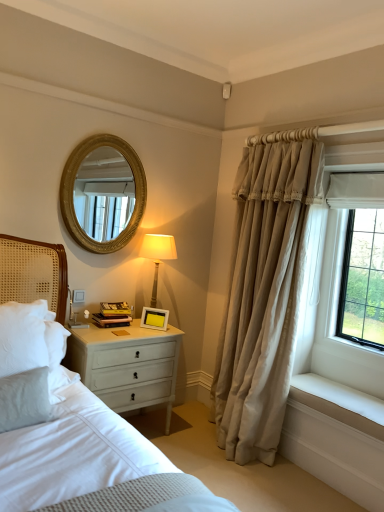
Image resolution: width=384 pixels, height=512 pixels. I want to click on white painted wood nightstand at lower left, so click(x=127, y=365).

The image size is (384, 512). I want to click on matte beige lampshade at upper right, so click(157, 255).

Consider the image. How many degrees apart are the facing directions of white smooth window sill at lower right and matte beige lampshade at upper right?

90.8 degrees.

You are a GUI agent. You are given a task and a screenshot of the screen. Output one action in this format:
    pyautogui.click(x=<x>, y=<y>)
    Task: Click on the window sill on the right of matte beige lampshade at upper right
    This screenshot has width=384, height=512.
    Given the screenshot: What is the action you would take?
    pyautogui.click(x=341, y=395)

Do you think white smooth window sill at lower right is within matte beige lampshade at upper right, or outside of it?

The correct answer is: outside.

Which is behind, white smooth window sill at lower right or matte beige lampshade at upper right?

matte beige lampshade at upper right is more distant.

Locate an element on the screen. The height and width of the screenshot is (512, 384). picture frame to the right of gold textured mirror at upper center is located at coordinates (154, 318).

Which is closer, (154, 323) or (95, 210)?

The point (154, 323) is closer to the camera.

Is white matte picture frame at upper right in contact with gold textured mirror at upper center?

No, white matte picture frame at upper right is not making contact with gold textured mirror at upper center.

Who is smaller, hardcover books at bedside or white painted wood nightstand at lower left?

With smaller size is hardcover books at bedside.

Locate an element on the screen. This screenshot has height=512, width=384. nightstand that is under the hardcover books at bedside (from a real-world perspective) is located at coordinates (127, 365).

From a real-world perspective, is hardcover books at bedside physically below white painted wood nightstand at lower left?

No.

Considering the positions of points (120, 302) and (146, 400), is point (120, 302) farther from camera compared to point (146, 400)?

That is True.

Is white painted wood nightstand at lower left touching hardcover books at bedside?

white painted wood nightstand at lower left and hardcover books at bedside are not in contact.

Considering the sizes of objects white painted wood nightstand at lower left and hardcover books at bedside in the image provided, who is smaller, white painted wood nightstand at lower left or hardcover books at bedside?

hardcover books at bedside.

Does point (140, 334) lie behind point (102, 324)?

No, (140, 334) is closer to viewer.

From the picture: Which of these two, white painted wood nightstand at lower left or hardcover books at bedside, stands taller?

Standing taller between the two is white painted wood nightstand at lower left.

Does white smooth window sill at lower right have a larger size compared to white matte picture frame at upper right?

Yes, white smooth window sill at lower right is bigger than white matte picture frame at upper right.

Is white smooth window sill at lower right outside of white matte picture frame at upper right?

Indeed, white smooth window sill at lower right is completely outside white matte picture frame at upper right.

Is white smooth window sill at lower right not close to white matte picture frame at upper right?

That's right, there is a large distance between white smooth window sill at lower right and white matte picture frame at upper right.

Is white smooth window sill at lower right oriented towards white matte picture frame at upper right?

No, white smooth window sill at lower right is not aimed at white matte picture frame at upper right.

Are beige fabric curtain at right and matte beige lampshade at upper right far apart?

No.

Measure the distance between beige fabric curtain at right and matte beige lampshade at upper right.

beige fabric curtain at right is 34.93 inches away from matte beige lampshade at upper right.

Does point (267, 248) come behind point (141, 245)?

No, (267, 248) is in front of (141, 245).

Find the location of a particular element. picture frame that is behind the beige fabric curtain at right is located at coordinates (154, 318).

From the image's perspective, relative to beige fabric curtain at right, is white matte picture frame at upper right above or below?

Clearly, from the image's perspective, white matte picture frame at upper right is below beige fabric curtain at right.

Consider the image. Considering the sizes of white matte picture frame at upper right and beige fabric curtain at right in the image, is white matte picture frame at upper right bigger or smaller than beige fabric curtain at right?

Clearly, white matte picture frame at upper right is smaller in size than beige fabric curtain at right.

What are the coordinates of `window sill that is on the right side of matte beige lampshade at upper right` in the screenshot? It's located at (341, 395).

You are a GUI agent. You are given a task and a screenshot of the screen. Output one action in this format:
    pyautogui.click(x=<x>, y=<y>)
    Task: Click on the mirror on the left of white matte picture frame at upper right
    Image resolution: width=384 pixels, height=512 pixels.
    Given the screenshot: What is the action you would take?
    pyautogui.click(x=104, y=194)

Considering their positions, is white painted wood nightstand at lower left positioned further to gold textured mirror at upper center than matte beige lampshade at upper right?

Among the two, white painted wood nightstand at lower left is located further to gold textured mirror at upper center.

Estimate the real-world distances between objects in this image. Which object is closer to white painted wood nightstand at lower left, gold textured mirror at upper center or hardcover books at bedside?

hardcover books at bedside.

When comparing their distances from white painted wood nightstand at lower left, does beige fabric curtain at right or hardcover books at bedside seem further?

beige fabric curtain at right is further to white painted wood nightstand at lower left.

When comparing their distances from matte beige lampshade at upper right, does gold textured mirror at upper center or white matte picture frame at upper right seem closer?

white matte picture frame at upper right is closer to matte beige lampshade at upper right.

Considering their positions, is gold textured mirror at upper center positioned further to hardcover books at bedside than white painted wood nightstand at lower left?

Among the two, gold textured mirror at upper center is located further to hardcover books at bedside.

When comparing their distances from beige fabric curtain at right, does white matte picture frame at upper right or white painted wood nightstand at lower left seem closer?

white painted wood nightstand at lower left lies closer to beige fabric curtain at right than the other object.

Estimate the real-world distances between objects in this image. Which object is closer to matte beige lampshade at upper right, white painted wood nightstand at lower left or white matte picture frame at upper right?

white matte picture frame at upper right lies closer to matte beige lampshade at upper right than the other object.

Based on their spatial positions, is white smooth window sill at lower right or white painted wood nightstand at lower left further from gold textured mirror at upper center?

white smooth window sill at lower right is positioned further to the anchor gold textured mirror at upper center.

You are a GUI agent. You are given a task and a screenshot of the screen. Output one action in this format:
    pyautogui.click(x=<x>, y=<y>)
    Task: Click on the bedside lamp between gold textured mirror at upper center and white painted wood nightstand at lower left in the vertical direction
    
    Given the screenshot: What is the action you would take?
    pyautogui.click(x=157, y=255)

You are a GUI agent. You are given a task and a screenshot of the screen. Output one action in this format:
    pyautogui.click(x=<x>, y=<y>)
    Task: Click on the bedside lamp between gold textured mirror at upper center and white smooth window sill at lower right
    
    Given the screenshot: What is the action you would take?
    pyautogui.click(x=157, y=255)

This screenshot has height=512, width=384. I want to click on nightstand located between hardcover books at bedside and white smooth window sill at lower right in the left-right direction, so click(127, 365).

Where is `picture frame that lies between hardcover books at bedside and white painted wood nightstand at lower left from top to bottom`? picture frame that lies between hardcover books at bedside and white painted wood nightstand at lower left from top to bottom is located at coordinates (154, 318).